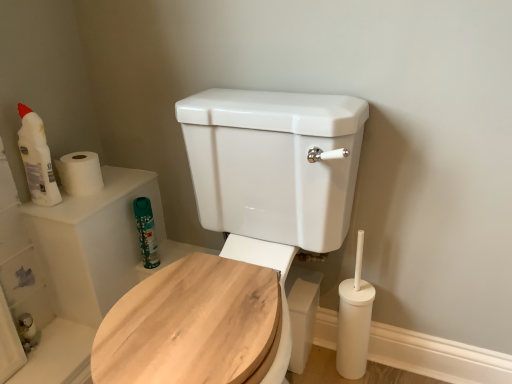
At what (x,y) coordinates should I click in order to perform the action: click on free space to the right of matte white bottle at upper left, the 2th cleaning product when ordered from back to front. Please return your answer as a coordinate pair (x, y). This screenshot has width=512, height=384. Looking at the image, I should click on (94, 196).